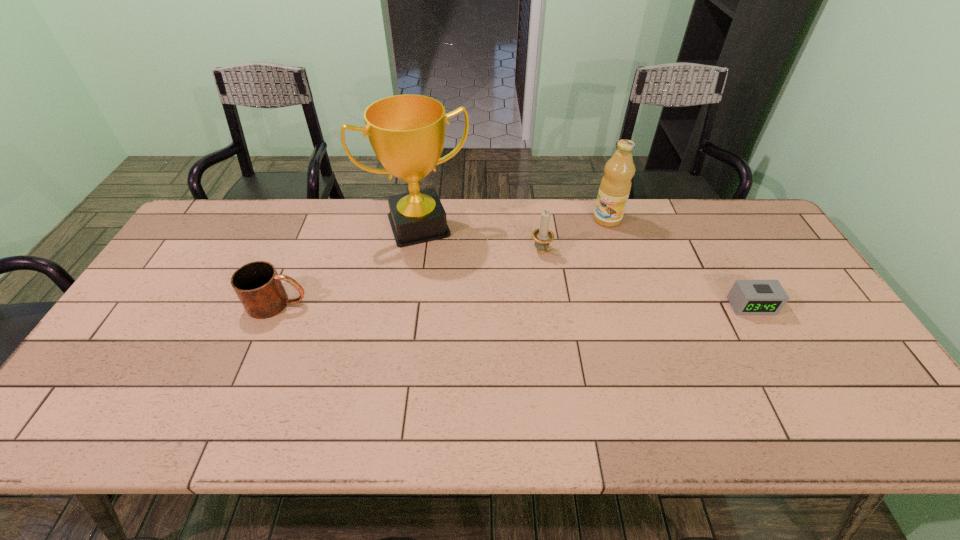
Where is `object that is the fourth closest to the third shortest object`? The width and height of the screenshot is (960, 540). object that is the fourth closest to the third shortest object is located at coordinates (257, 284).

The width and height of the screenshot is (960, 540). I want to click on the fourth closest object to the mug, so click(x=747, y=297).